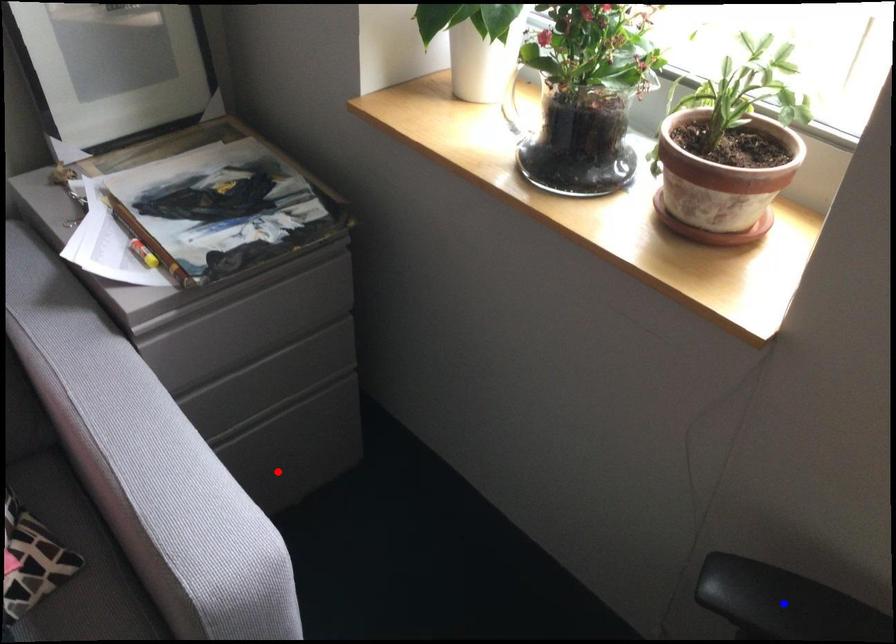
Question: In the image, two points are highlighted. Which point is nearer to the camera? Reply with the corresponding letter.

Choices:
 (A) blue point
 (B) red point

Answer: (A)